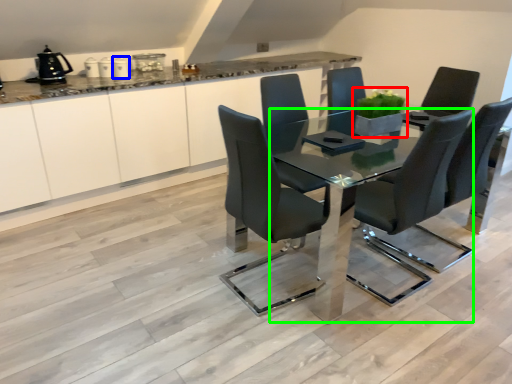
Question: Which is farther away from houseplant (highlighted by a red box)? appliance (highlighted by a blue box) or table (highlighted by a green box)?

Choices:
 (A) appliance
 (B) table

Answer: (A)